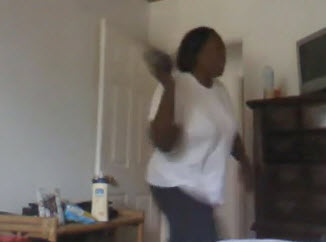
Locate an element on the screen. dresser is located at coordinates (284, 127).